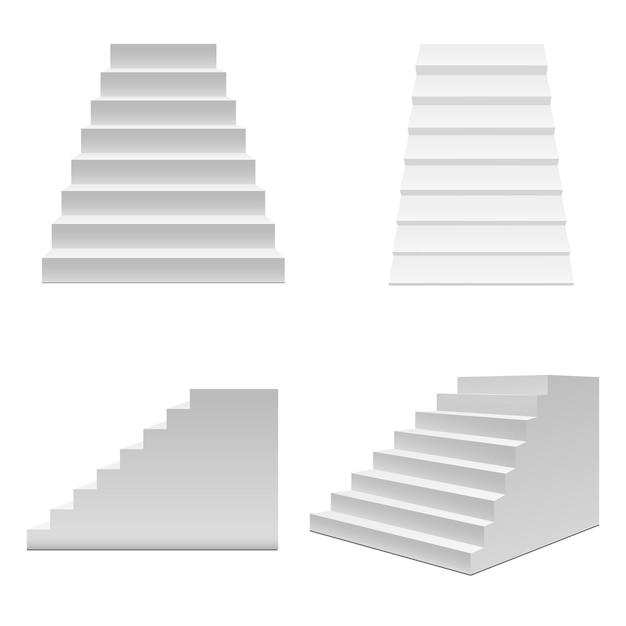
Locate an element on the screen. The width and height of the screenshot is (626, 626). steps on lower left staircase is located at coordinates (34, 531), (62, 509), (85, 496), (103, 475), (130, 456), (149, 439), (176, 419), (213, 398).